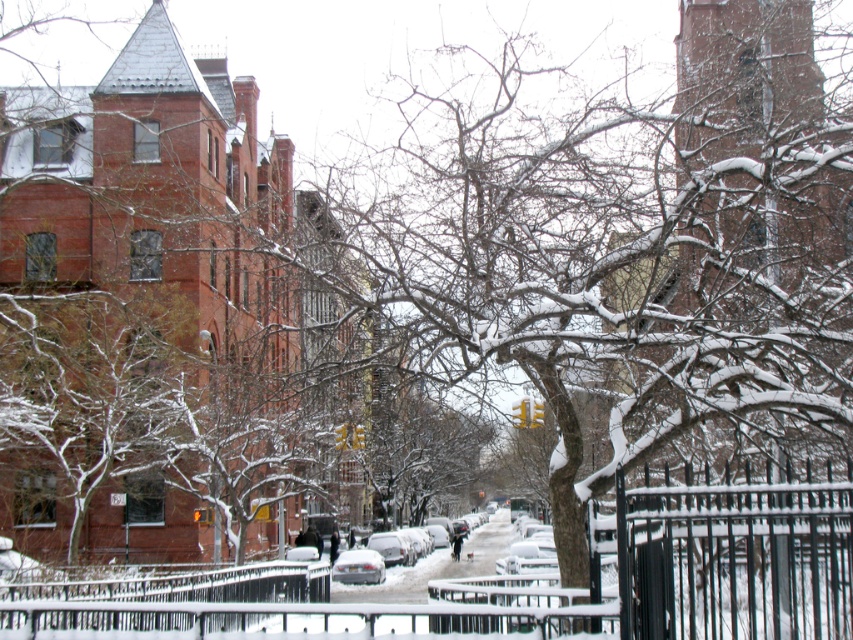
Question: From the image, what is the correct spatial relationship of black metal fence at lower center in relation to silver metallic car at center?

Choices:
 (A) right
 (B) left

Answer: (B)

Question: Which of the following is the closest to the observer?

Choices:
 (A) black metal fence at lower center
 (B) silver metallic car at center

Answer: (A)

Question: Among these objects, which one is farthest from the camera?

Choices:
 (A) black metal fence at lower center
 (B) silver metallic car at center

Answer: (B)

Question: Can you confirm if black metal fence at lower center is positioned to the right of silver metallic car at center?

Choices:
 (A) no
 (B) yes

Answer: (A)

Question: Is the position of black metal fence at lower center more distant than that of silver metallic car at center?

Choices:
 (A) no
 (B) yes

Answer: (A)